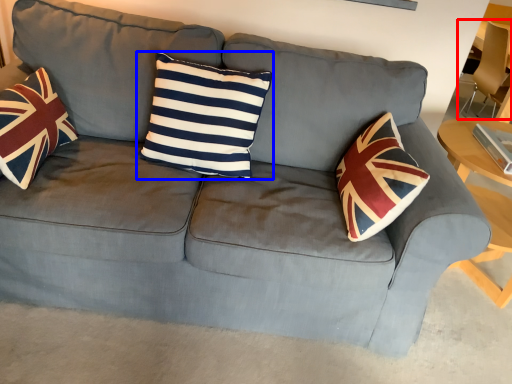
Question: Which object is closer to the camera taking this photo, armchair (highlighted by a red box) or pillow (highlighted by a blue box)?

Choices:
 (A) armchair
 (B) pillow

Answer: (B)